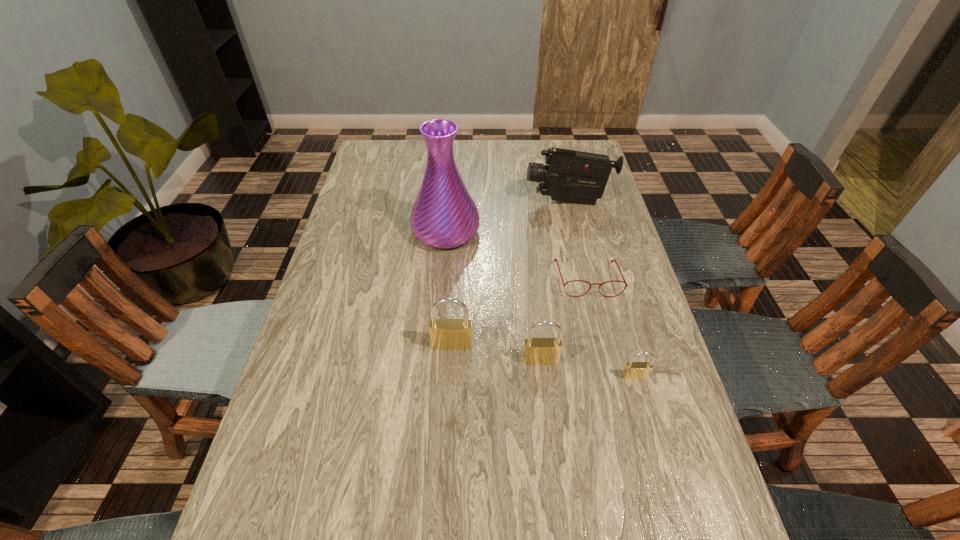
At what (x,y) coordinates should I click in order to perform the action: click on the farthest padlock. Please return your answer as a coordinate pair (x, y). The width and height of the screenshot is (960, 540). Looking at the image, I should click on (448, 333).

This screenshot has height=540, width=960. I want to click on the leftmost padlock, so click(x=448, y=333).

Find the location of `the second farthest padlock`. the second farthest padlock is located at coordinates (537, 351).

Locate an element on the screen. The image size is (960, 540). the second tallest padlock is located at coordinates (537, 351).

I want to click on the nearest object, so click(x=633, y=370).

Find the location of `the rightmost padlock`. the rightmost padlock is located at coordinates tap(633, 370).

You are a GUI agent. You are given a task and a screenshot of the screen. Output one action in this format:
    pyautogui.click(x=<x>, y=<y>)
    Task: Click on the vase
    The width and height of the screenshot is (960, 540).
    Given the screenshot: What is the action you would take?
    pyautogui.click(x=444, y=215)

Where is `the fifth nearest object`? the fifth nearest object is located at coordinates click(444, 215).

Where is `the farthest object`? the farthest object is located at coordinates (569, 175).

The image size is (960, 540). What are the coordinates of `the third farthest object` in the screenshot? It's located at (555, 259).